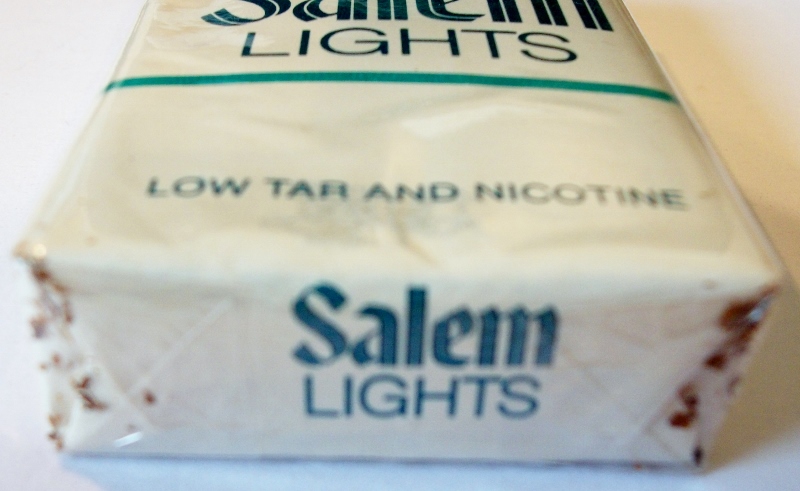
Identify the location of white table. (474, 475).